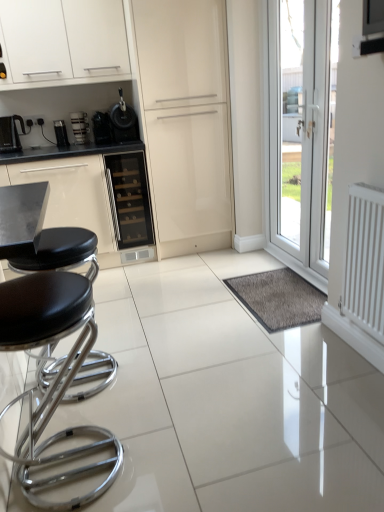
Question: Is white glossy cabinet at upper left positioned beyond the bounds of matte black coffee machine at left, positioned as the 1th coffee machine in left-to-right order?

Choices:
 (A) yes
 (B) no

Answer: (A)

Question: Would you say matte black coffee machine at left, positioned as the 1th coffee machine in left-to-right order, is part of white glossy cabinet at upper left's contents?

Choices:
 (A) yes
 (B) no

Answer: (B)

Question: From a real-world perspective, is white glossy cabinet at upper left positioned under matte black coffee machine at left, the second coffee machine from the right, based on gravity?

Choices:
 (A) no
 (B) yes

Answer: (A)

Question: Is white glossy cabinet at upper left far from matte black coffee machine at left, the second coffee machine from the right?

Choices:
 (A) no
 (B) yes

Answer: (A)

Question: Is white glossy cabinet at upper left at the left side of matte black coffee machine at left, the second coffee machine from the right?

Choices:
 (A) yes
 (B) no

Answer: (B)

Question: In the image, is glossy cream cabinet at center on the left side or the right side of white glossy cabinet at upper left?

Choices:
 (A) right
 (B) left

Answer: (A)

Question: Based on their sizes in the image, would you say glossy cream cabinet at center is bigger or smaller than white glossy cabinet at upper left?

Choices:
 (A) small
 (B) big

Answer: (B)

Question: From the image's perspective, is glossy cream cabinet at center positioned above or below white glossy cabinet at upper left?

Choices:
 (A) below
 (B) above

Answer: (A)

Question: Which is correct: glossy cream cabinet at center is inside white glossy cabinet at upper left, or outside of it?

Choices:
 (A) inside
 (B) outside

Answer: (B)

Question: From a real-world perspective, relative to white matte radiator at right, is transparent glass door at right vertically above or below?

Choices:
 (A) below
 (B) above

Answer: (B)

Question: In terms of width, does transparent glass door at right look wider or thinner when compared to white matte radiator at right?

Choices:
 (A) wide
 (B) thin

Answer: (B)

Question: From the image's perspective, relative to white matte radiator at right, is transparent glass door at right above or below?

Choices:
 (A) below
 (B) above

Answer: (B)

Question: In terms of size, does transparent glass door at right appear bigger or smaller than white matte radiator at right?

Choices:
 (A) big
 (B) small

Answer: (A)

Question: Would you say satin black coffee machine at center, acting as the 2th coffee machine starting from the left, is to the left or to the right of transparent glass door at right in the picture?

Choices:
 (A) right
 (B) left

Answer: (B)

Question: Considering their positions, is satin black coffee machine at center, acting as the 2th coffee machine starting from the left, located in front of or behind transparent glass door at right?

Choices:
 (A) front
 (B) behind

Answer: (B)